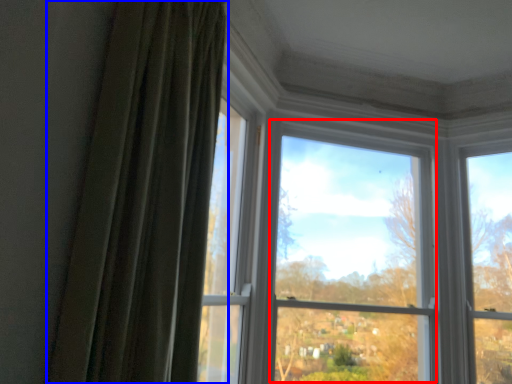
Question: Which object appears closest to the camera in this image, bay window (highlighted by a red box) or curtain (highlighted by a blue box)?

Choices:
 (A) bay window
 (B) curtain

Answer: (B)